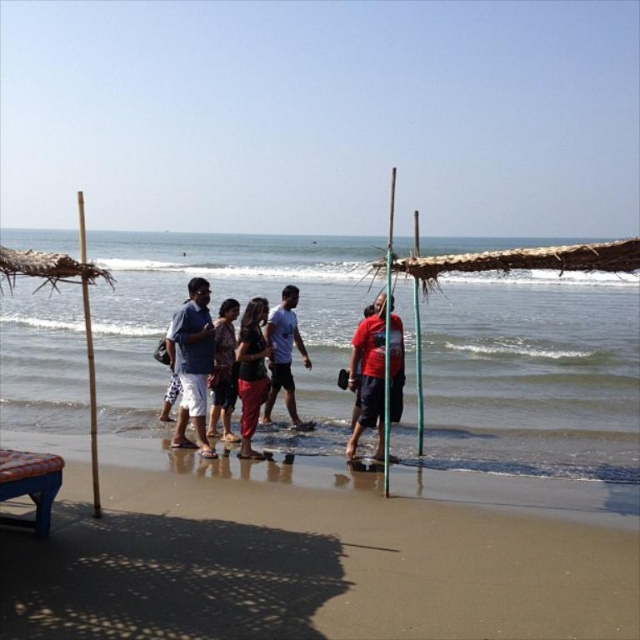
Between light blue cotton shirt at center and green bamboo pole at center, which one appears on the right side from the viewer's perspective?

green bamboo pole at center is more to the right.

Between light blue cotton shirt at center and green bamboo pole at center, which one has more height?

light blue cotton shirt at center is taller.

Which is behind, point (300, 340) or point (417, 256)?

Point (300, 340)

Where is `light blue cotton shirt at center`? light blue cotton shirt at center is located at coordinates [x=284, y=355].

The width and height of the screenshot is (640, 640). What do you see at coordinates (369, 376) in the screenshot?
I see `red matte shirt at center` at bounding box center [369, 376].

Which is above, red matte shirt at center or blue cotton shirt at center?

Positioned higher is red matte shirt at center.

Image resolution: width=640 pixels, height=640 pixels. Identify the location of red matte shirt at center. (369, 376).

Who is positioned more to the right, clear water at center or green bamboo pole at center?

green bamboo pole at center is more to the right.

Does point (138, 240) come behind point (419, 400)?

Yes, point (138, 240) is farther from viewer.

Identify the location of clear water at center. This screenshot has width=640, height=640. (532, 372).